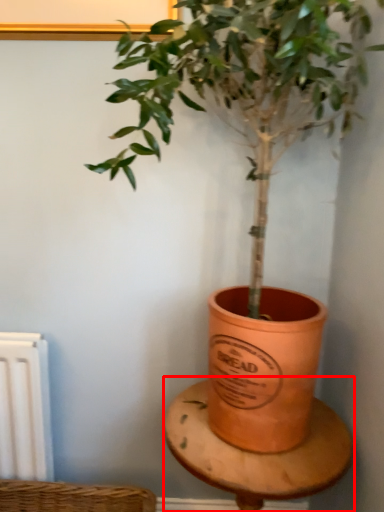
Question: Considering the relative positions of table (annotated by the red box) and houseplant in the image provided, where is table (annotated by the red box) located with respect to the staircase?

Choices:
 (A) left
 (B) right

Answer: (B)